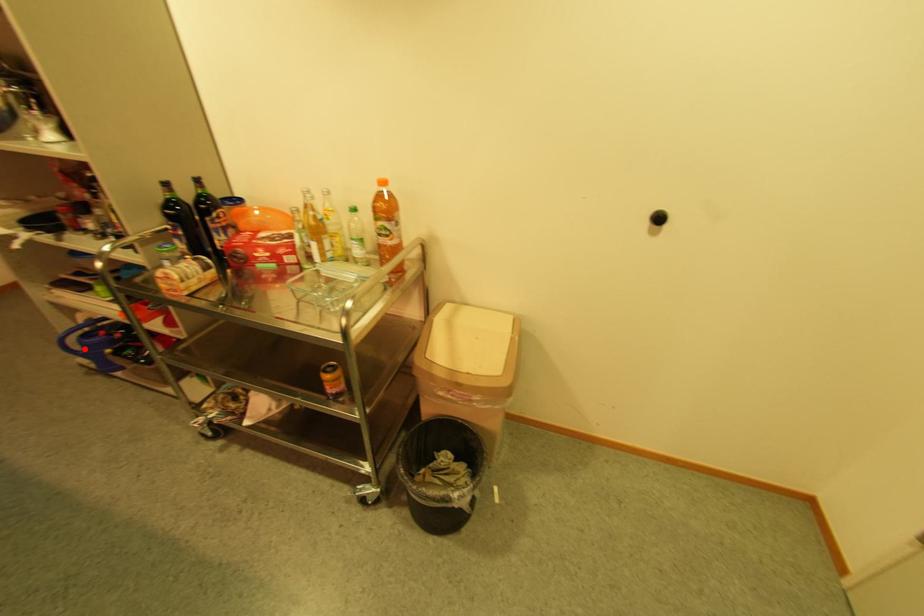
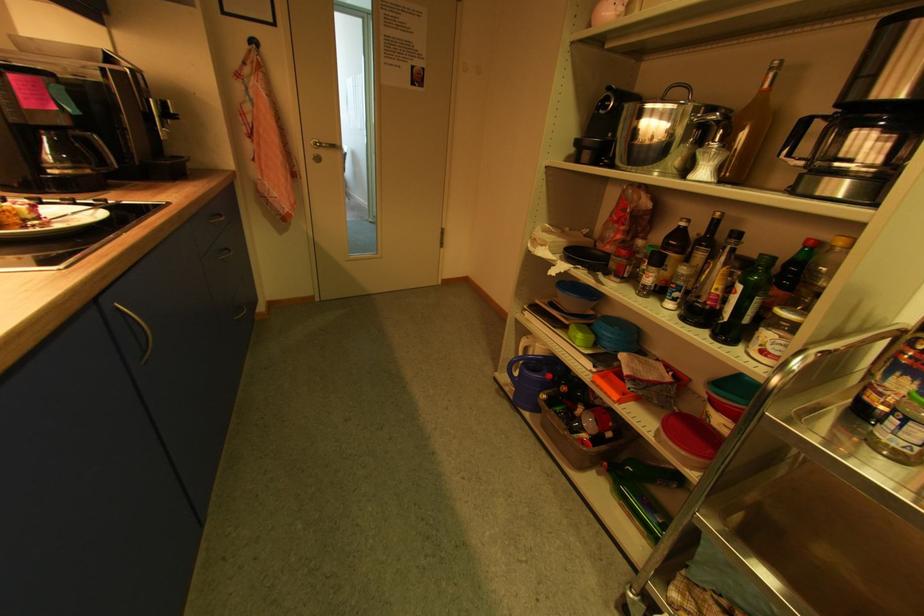
Where in the second image is the point corresponding to the highlighted location from the first image?

(521, 375)